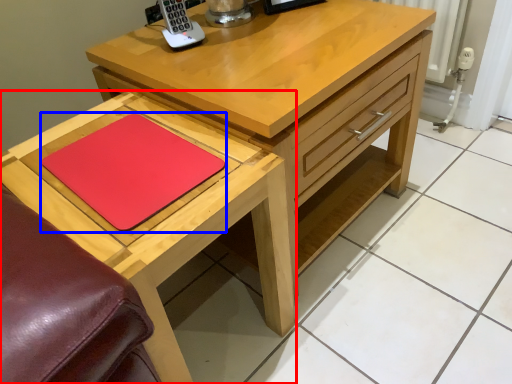
Question: Which object is closer to the camera taking this photo, table (highlighted by a red box) or pad (highlighted by a blue box)?

Choices:
 (A) table
 (B) pad

Answer: (A)